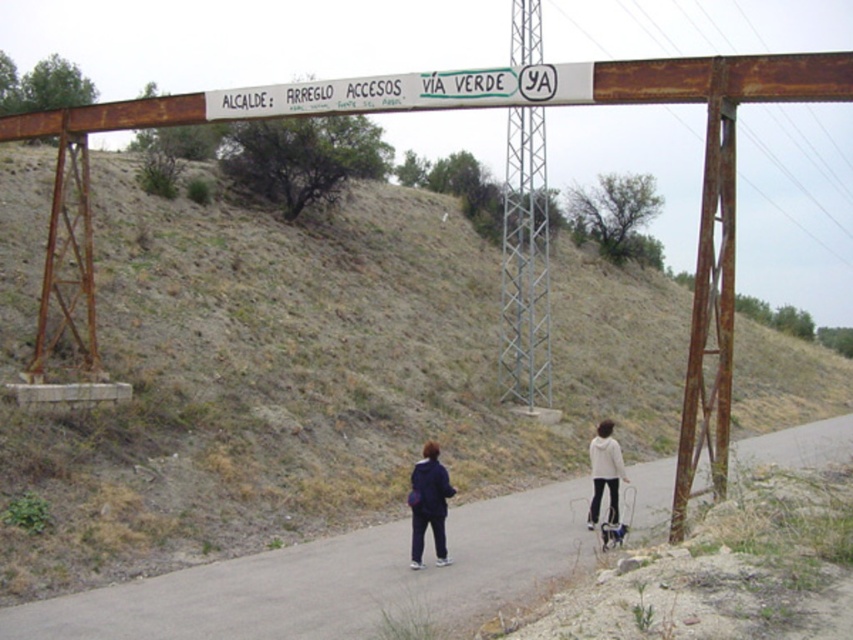
Is white painted metal signboard at upper center thinner than white fleece jacket at lower right?

In fact, white painted metal signboard at upper center might be wider than white fleece jacket at lower right.

Does white painted metal signboard at upper center have a greater width compared to white fleece jacket at lower right?

Correct, the width of white painted metal signboard at upper center exceeds that of white fleece jacket at lower right.

Which is in front, point (445, 72) or point (595, 476)?

Point (445, 72) is in front.

This screenshot has height=640, width=853. I want to click on white painted metal signboard at upper center, so click(x=409, y=92).

Does asphalt road at center have a greater height compared to white painted metal signboard at upper center?

No.

Does point (225, 620) come closer to viewer compared to point (332, 99)?

Yes, it is.

Identify the location of asphalt road at center. (335, 580).

Can you confirm if dull brown dirt at upper center is taller than asphalt road at center?

Yes.

How far apart are dull brown dirt at upper center and asphalt road at center?

The distance of dull brown dirt at upper center from asphalt road at center is 24.64 feet.

The image size is (853, 640). I want to click on dull brown dirt at upper center, so (308, 380).

Find the location of a particular element. This screenshot has width=853, height=640. dull brown dirt at upper center is located at coordinates (308, 380).